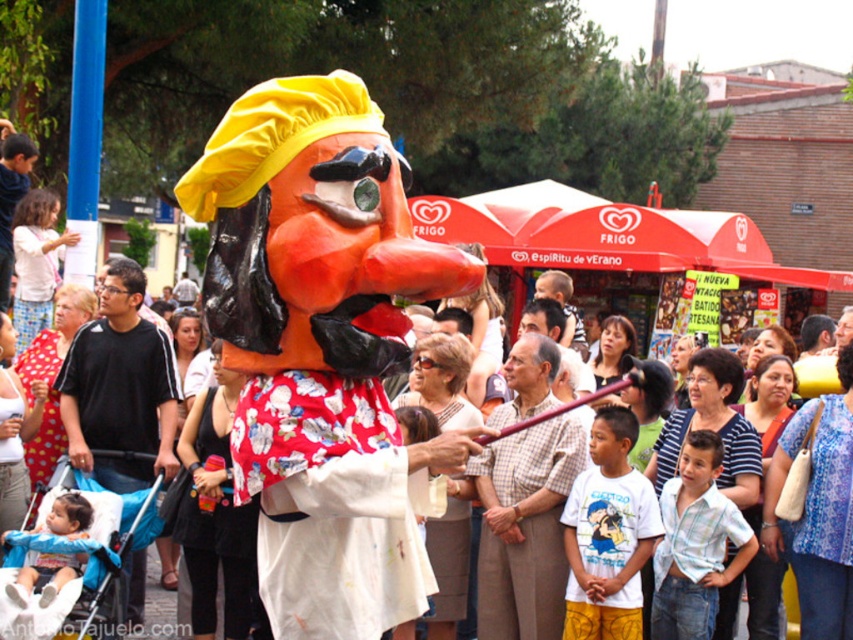
Who is positioned more to the right, printed fabric cape at center or black cotton shirt at center?

printed fabric cape at center is more to the right.

What do you see at coordinates (331, 506) in the screenshot?
I see `printed fabric cape at center` at bounding box center [331, 506].

The image size is (853, 640). Identify the location of printed fabric cape at center. (331, 506).

How far apart are checkered fabric shirt at center and matte black shirt at left?

10.12 meters

Is point (554, 490) positioned after point (30, 157)?

No.

Where is `checkered fabric shirt at center`? The image size is (853, 640). checkered fabric shirt at center is located at coordinates (525, 529).

Can you confirm if printed fabric cape at center is thinner than matte black shirt at left?

Incorrect, printed fabric cape at center's width is not less than matte black shirt at left's.

Find the location of a particular element. This screenshot has height=640, width=853. printed fabric cape at center is located at coordinates (331, 506).